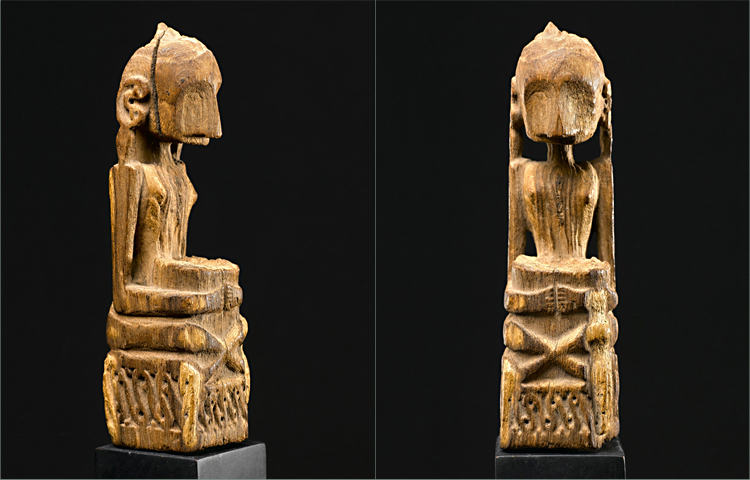
At what (x,y) coordinates should I click in order to perform the action: click on black stand. Please return your answer as a coordinate pair (x, y). The width and height of the screenshot is (750, 480). Looking at the image, I should click on (564, 458), (187, 462).